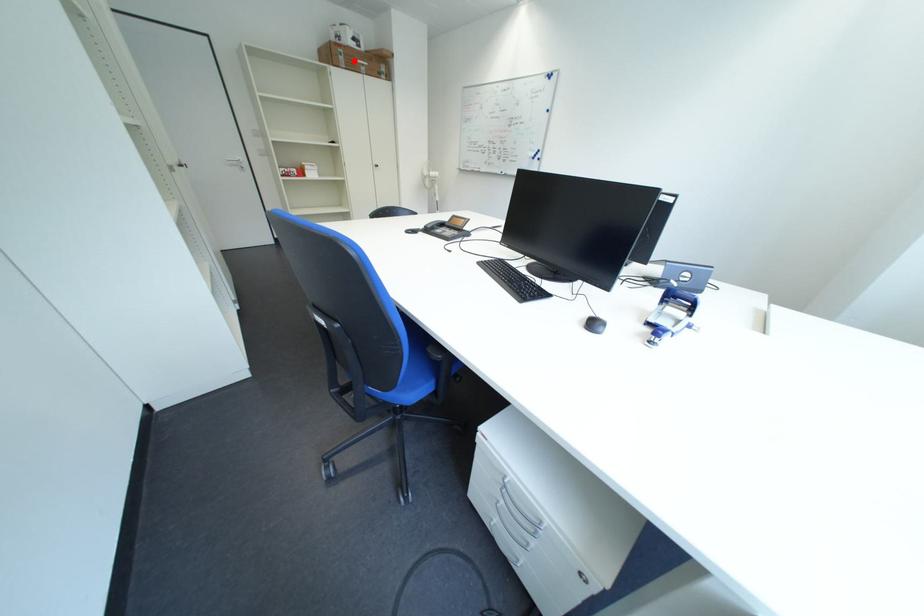
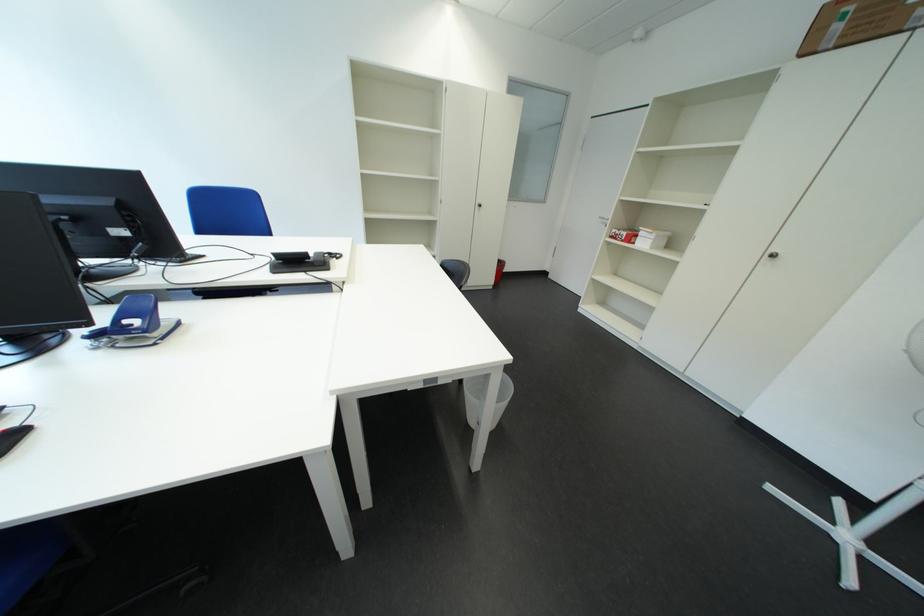
Question: I am providing you with two images of the same scene from different viewpoints. A red point is shown in image1. For the corresponding object point in image2, is it positioned nearer or farther from the camera?

Choices:
 (A) Nearer
 (B) Farther

Answer: (B)